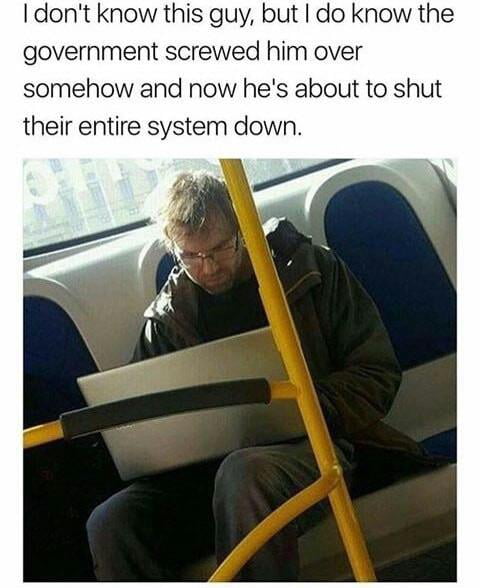
Where is `laptop`? laptop is located at coordinates (199, 366).